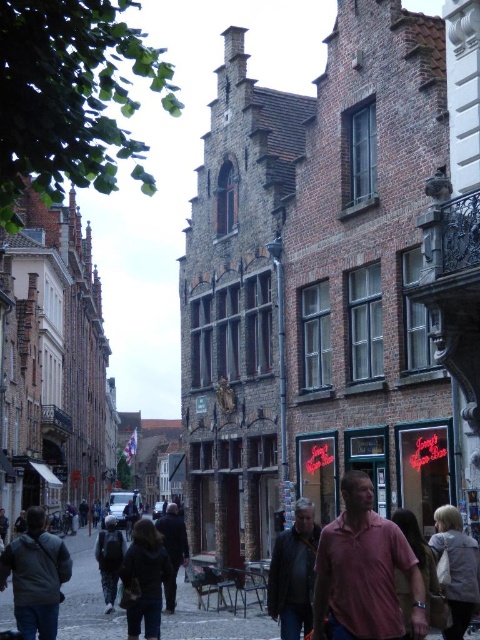
Which is behind, point (280, 536) or point (172, 593)?

The point (172, 593) is more distant.

Can you confirm if leather jacket at center is positioned below dark brown leather jacket at center?

No.

Is point (313, 572) behind point (178, 513)?

No, (313, 572) is in front of (178, 513).

This screenshot has height=640, width=480. I want to click on leather jacket at center, so click(294, 572).

Is point (32, 634) positioned after point (160, 548)?

No, (32, 634) is closer to viewer.

Between point (32, 560) and point (136, 602), which one is positioned behind?

Point (136, 602)

Where is `dark gray jacket at lower left`? dark gray jacket at lower left is located at coordinates (36, 577).

Is point (315, 538) positioned after point (448, 554)?

Yes, it is behind point (448, 554).

Which is behind, point (278, 580) or point (440, 532)?

The point (440, 532) is behind.

Which is in front, point (307, 576) or point (463, 595)?

Positioned in front is point (463, 595).

This screenshot has height=640, width=480. In order to click on leather jacket at center in this screenshot , I will do `click(294, 572)`.